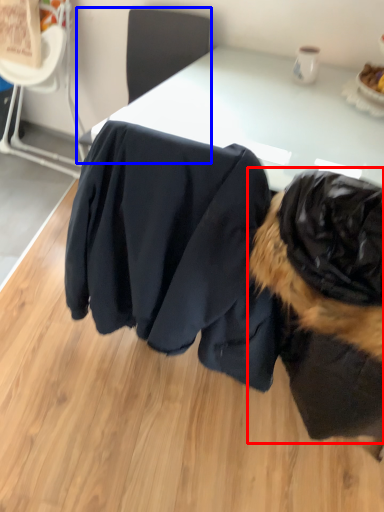
Question: Which point is closer to the camera, dog (highlighted by a red box) or chair (highlighted by a blue box)?

Choices:
 (A) dog
 (B) chair

Answer: (A)